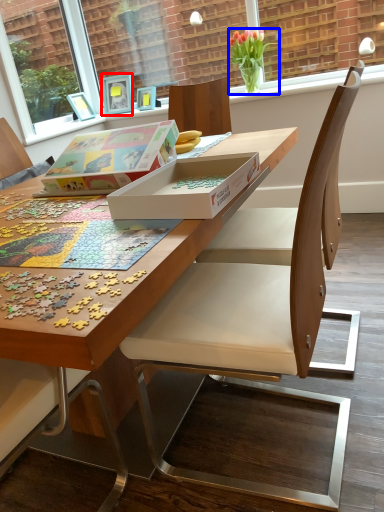
Question: Which point is closer to the camera, picture frame (highlighted by a red box) or houseplant (highlighted by a blue box)?

Choices:
 (A) picture frame
 (B) houseplant

Answer: (B)